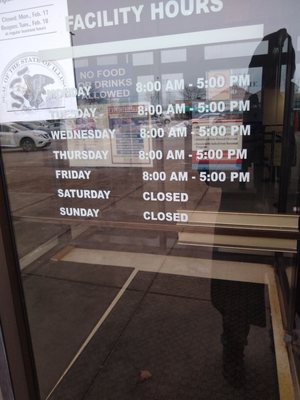
The width and height of the screenshot is (300, 400). Identify the location of floor mat. (167, 332), (68, 297).